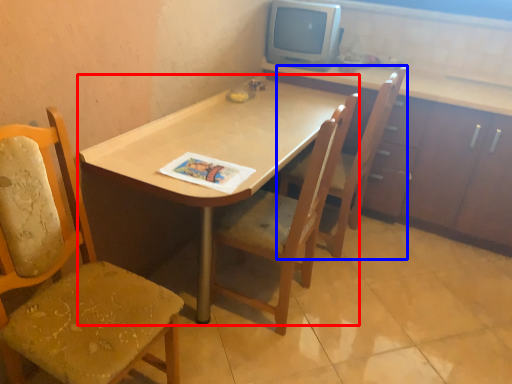
Question: Which of the following is the farthest to the observer, desk (highlighted by a red box) or chair (highlighted by a blue box)?

Choices:
 (A) desk
 (B) chair

Answer: (B)